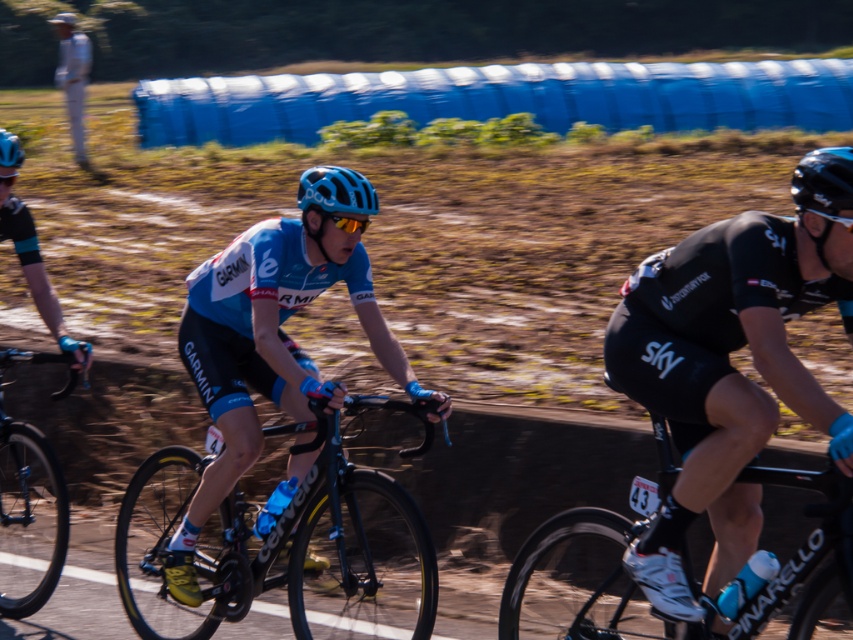
You are a photographer trying to capture a closeup shot of the black carbon fiber bicycle at center and the black matte helmet at upper right. Since you want both to be clearly visible, which object should you zoom in on less to ensure both are in frame?

The black carbon fiber bicycle at center is bigger than the black matte helmet at upper right, so you should zoom in less on the black carbon fiber bicycle at center to ensure both are in frame.

You are a photographer positioned at the starting line of the cycling race. You want to capture a photo that includes both the central cyclist in light blue and the cyclist on the right in black. However, you notice two points of interest marked at coordinates point (x=45, y=452) and point (x=10, y=138). Which point should you focus on first to ensure both cyclists are in frame?

You should focus on point (x=45, y=452) first because it is closer to you than point (x=10, y=138). This ensures both cyclists remain in the frame as you adjust the camera.

In the scene shown: You are a spectator at the cycling race and want to take a photo of both the black matte helmet at upper right and the blue matte helmet at center. Which helmet should you adjust your camera to the right to capture?

You should adjust your camera to the right to capture the black matte helmet at upper right because it is positioned to the right of the blue matte helmet at center.